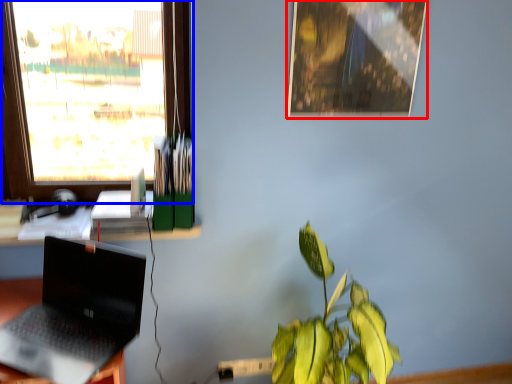
Question: Which object appears closest to the camera in this image, picture frame (highlighted by a red box) or window (highlighted by a blue box)?

Choices:
 (A) picture frame
 (B) window

Answer: (B)